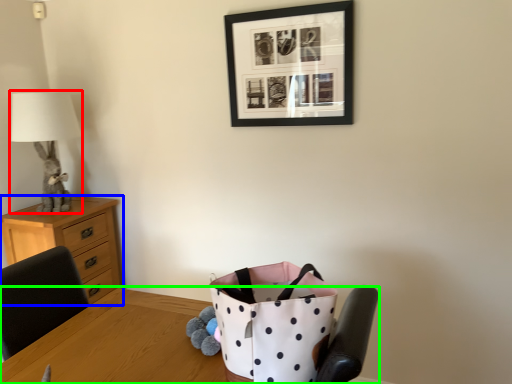
Question: Which is nearer to the table lamp (highlighted by a red box)? chest of drawers (highlighted by a blue box) or table (highlighted by a green box).

Choices:
 (A) chest of drawers
 (B) table

Answer: (A)